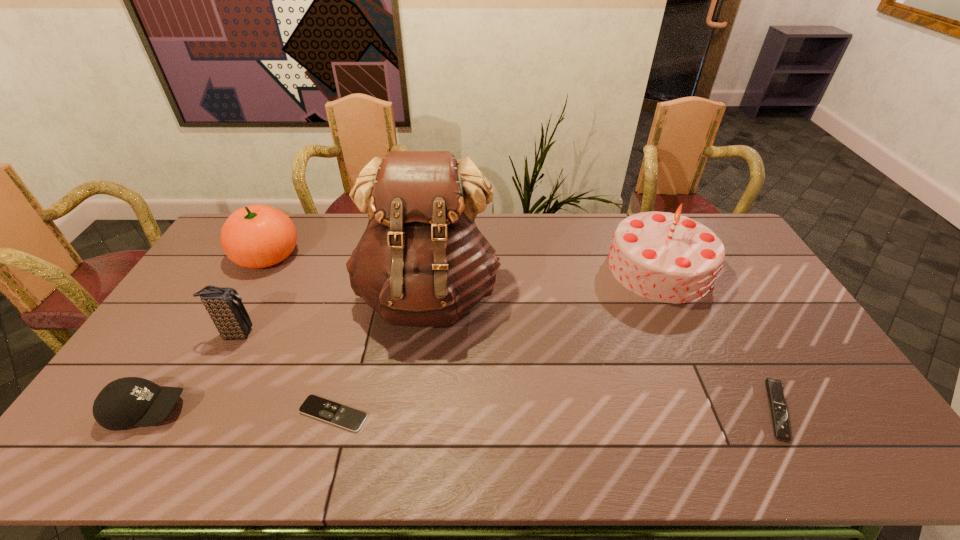
The image size is (960, 540). I want to click on the tallest object, so coord(422,262).

This screenshot has width=960, height=540. What are the coordinates of `birthday cake` in the screenshot? It's located at (666, 257).

Locate an element on the screen. The height and width of the screenshot is (540, 960). pumpkin is located at coordinates (256, 236).

Locate an element on the screen. clutch bag is located at coordinates (225, 307).

Where is `baseball cap`? The image size is (960, 540). baseball cap is located at coordinates (131, 401).

Locate an element on the screen. The height and width of the screenshot is (540, 960). the taller remote control is located at coordinates (781, 427).

Where is `the second shortest object`? This screenshot has width=960, height=540. the second shortest object is located at coordinates (781, 427).

The width and height of the screenshot is (960, 540). I want to click on the left remote control, so click(x=343, y=416).

The width and height of the screenshot is (960, 540). Find the location of `the shorter remote control`. the shorter remote control is located at coordinates pos(343,416).

Where is `free location located 0.090m at the front of the tallest object with buckles`? free location located 0.090m at the front of the tallest object with buckles is located at coordinates (419, 372).